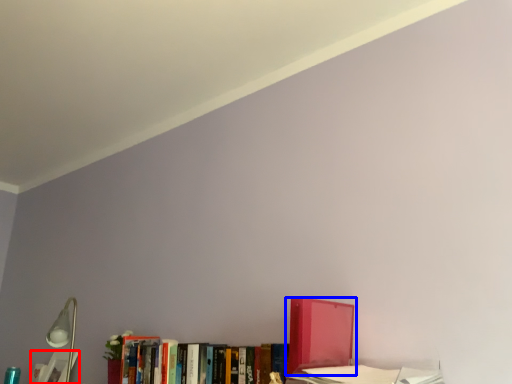
Question: Which point is further to the camera, book (highlighted by a red box) or book (highlighted by a blue box)?

Choices:
 (A) book
 (B) book

Answer: (A)